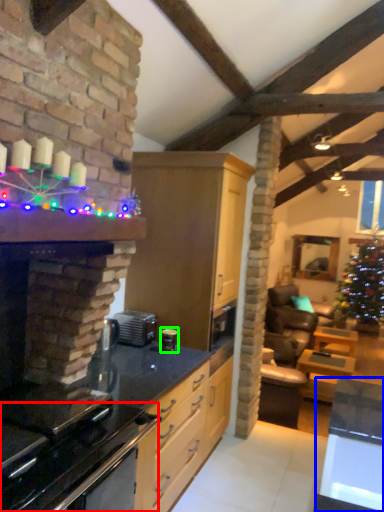
Question: Which is nearer to the oven (highlighted by a red box)? table (highlighted by a blue box) or appliance (highlighted by a green box).

Choices:
 (A) table
 (B) appliance

Answer: (A)